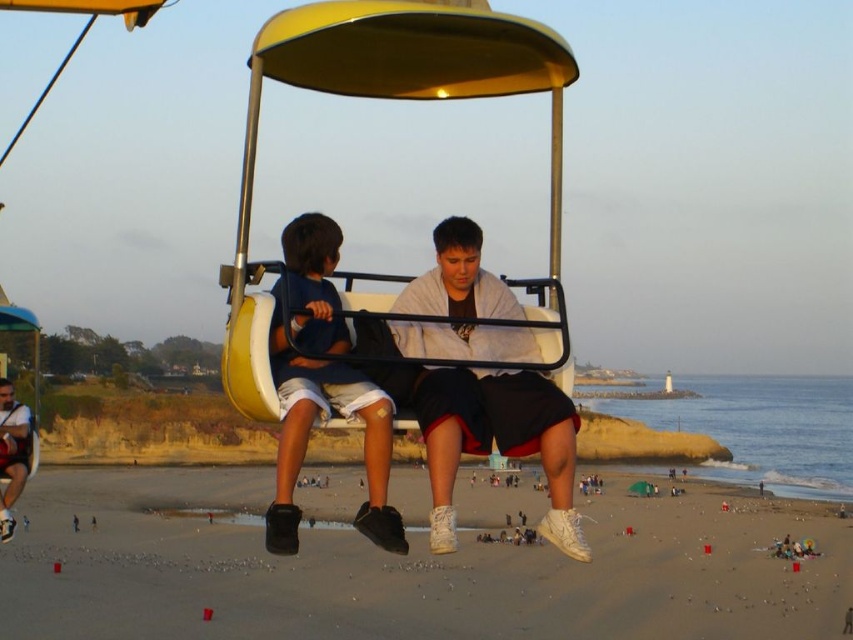
Between point (451, 454) and point (305, 228), which one is positioned in front?

Point (451, 454) is more forward.

Find the location of a particular element. This screenshot has width=853, height=640. gray cotton hoodie at center is located at coordinates (498, 442).

Image resolution: width=853 pixels, height=640 pixels. Describe the element at coordinates (498, 442) in the screenshot. I see `gray cotton hoodie at center` at that location.

In order to click on gray cotton hoodie at center in this screenshot , I will do `click(498, 442)`.

In the scene shown: Which is below, matte black shorts at center or matte white t-shirt at lower left?

matte white t-shirt at lower left is below.

You are a GUI agent. You are given a task and a screenshot of the screen. Output one action in this format:
    pyautogui.click(x=<x>, y=<y>)
    Task: Click on the matte black shorts at center
    
    Given the screenshot: What is the action you would take?
    pyautogui.click(x=322, y=387)

Image resolution: width=853 pixels, height=640 pixels. What are the coordinates of `matte black shorts at center` in the screenshot? It's located at (322, 387).

Can you confirm if yellow matte golf cart at center is positioned below matte black shorts at center?

No.

Between yellow matte golf cart at center and matte black shorts at center, which one appears on the right side from the viewer's perspective?

yellow matte golf cart at center is more to the right.

Does point (486, 284) come farther from viewer compared to point (368, 456)?

Yes, it is behind point (368, 456).

The width and height of the screenshot is (853, 640). Identify the location of yellow matte golf cart at center. (473, 381).